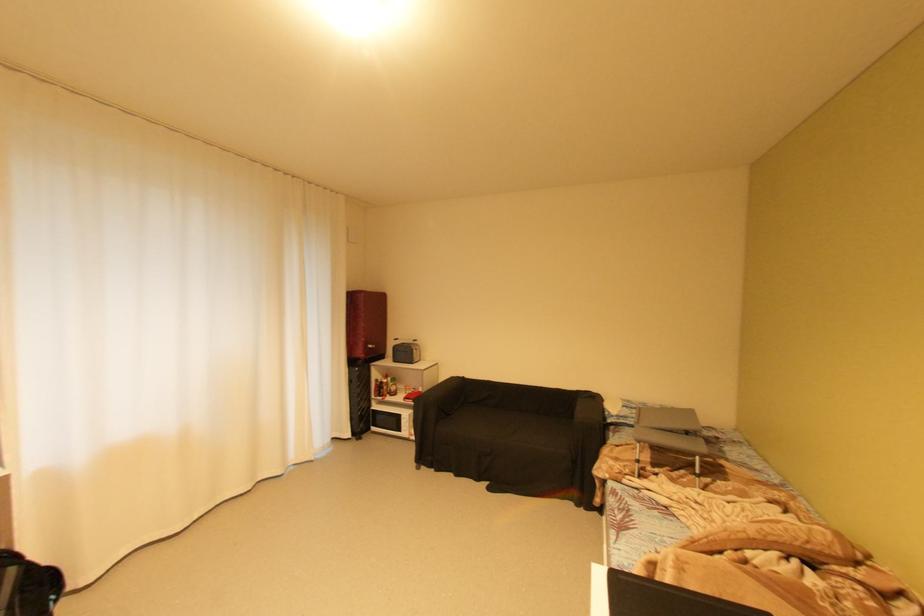
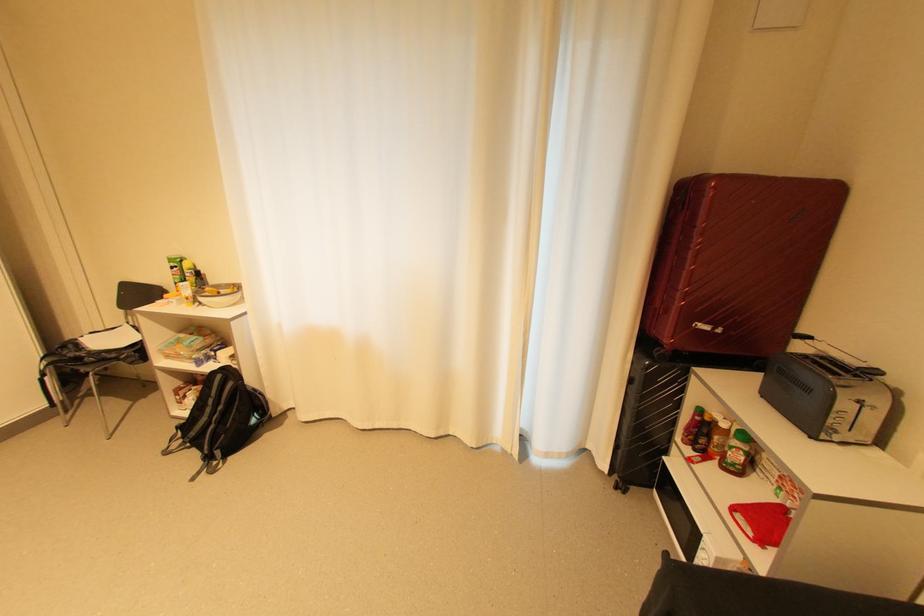
Question: I am providing you with two images of the same scene from different viewpoints. After the viewpoint changes to image2, which objects are now occluded?

Choices:
 (A) white bowl
 (B) green labeled bottle
 (C) red sauce bottle
 (D) none of these

Answer: (D)